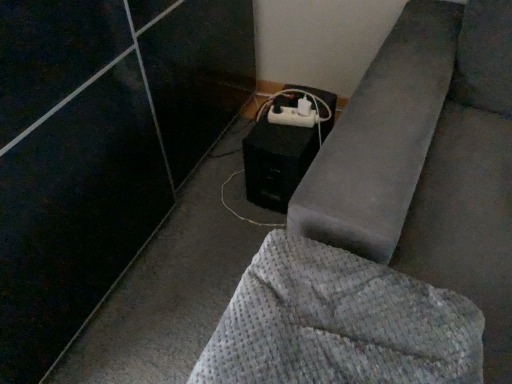
At what (x,y) coordinates should I click in order to perform the action: click on empty space that is ontop of black matte speaker at lower center. Please return your answer as a coordinate pair (x, y). The width and height of the screenshot is (512, 384). Looking at the image, I should click on (276, 124).